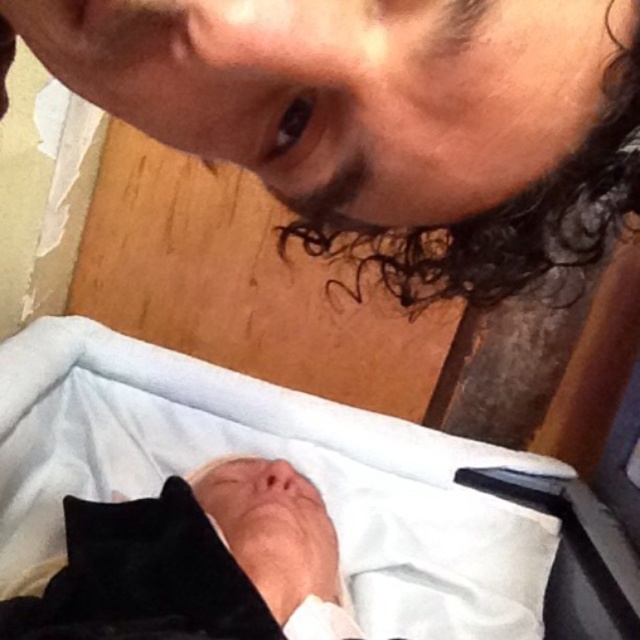
Image resolution: width=640 pixels, height=640 pixels. What do you see at coordinates (269, 458) in the screenshot?
I see `white fabric infant bed at lower center` at bounding box center [269, 458].

Which is in front, point (509, 620) or point (620, 198)?

Positioned in front is point (620, 198).

Who is more forward, (x=518, y=509) or (x=493, y=273)?

Point (x=493, y=273) is in front.

Where is `white fabric infant bed at lower center`? white fabric infant bed at lower center is located at coordinates (269, 458).

Looking at this image, can you confirm if white fabric infant bed at lower center is wider than black velvet newborn at lower center?

Indeed, white fabric infant bed at lower center has a greater width compared to black velvet newborn at lower center.

Which of these two, white fabric infant bed at lower center or black velvet newborn at lower center, stands taller?

With more height is white fabric infant bed at lower center.

Describe the element at coordinates (269, 458) in the screenshot. I see `white fabric infant bed at lower center` at that location.

Locate an element on the screen. The height and width of the screenshot is (640, 640). white fabric infant bed at lower center is located at coordinates (269, 458).

Which is above, black velvet newborn at lower center or curly dark brown hair at upper center?

curly dark brown hair at upper center is above.

Is point (227, 528) farther from camera compared to point (579, 243)?

Yes, it is behind point (579, 243).

This screenshot has height=640, width=640. Identify the location of black velvet newborn at lower center. (195, 564).